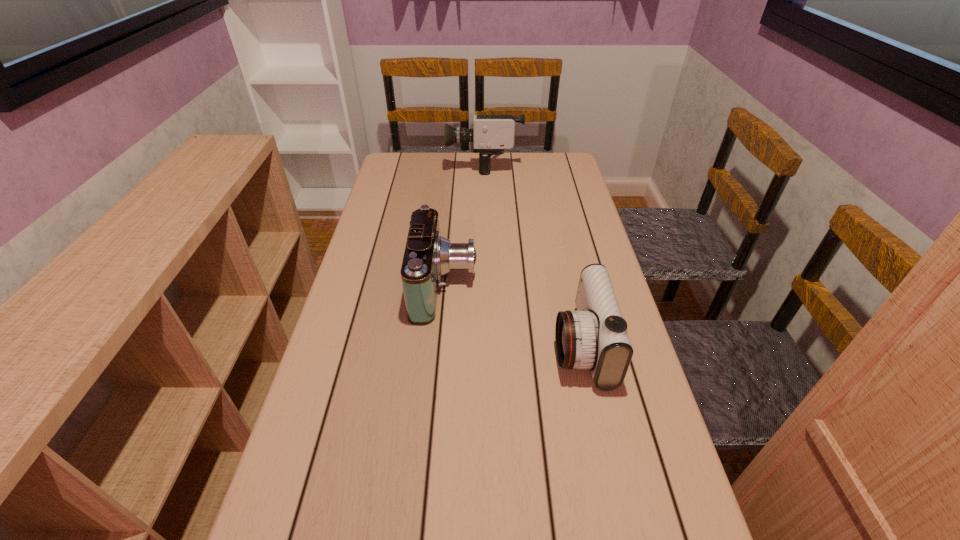
Find the location of `object at the right edge`. object at the right edge is located at coordinates (595, 337).

In the image, there is a desktop. In order to click on blank space at the far edge in this screenshot , I will do `click(448, 158)`.

In the image, there is a desktop. Where is `vacant space at the left edge`? The height and width of the screenshot is (540, 960). vacant space at the left edge is located at coordinates (402, 222).

In the image, there is a desktop. Identify the location of free space at the right edge. (576, 215).

The height and width of the screenshot is (540, 960). Find the location of `vacant space at the far right corner of the desktop`. vacant space at the far right corner of the desktop is located at coordinates (533, 164).

Where is `empty space that is in between the tallest camcorder and the rightmost object`? The width and height of the screenshot is (960, 540). empty space that is in between the tallest camcorder and the rightmost object is located at coordinates (533, 255).

Where is `vacant space that's between the tallest object and the rightmost camcorder`? The image size is (960, 540). vacant space that's between the tallest object and the rightmost camcorder is located at coordinates (533, 255).

Where is `unoccupied area between the farthest object and the rightmost object`? This screenshot has height=540, width=960. unoccupied area between the farthest object and the rightmost object is located at coordinates pos(533,255).

Where is `unoccupied position between the farthest object and the rightmost object`? unoccupied position between the farthest object and the rightmost object is located at coordinates (533, 255).

Where is `object that is the second closest to the rightmost camcorder`? Image resolution: width=960 pixels, height=540 pixels. object that is the second closest to the rightmost camcorder is located at coordinates (491, 134).